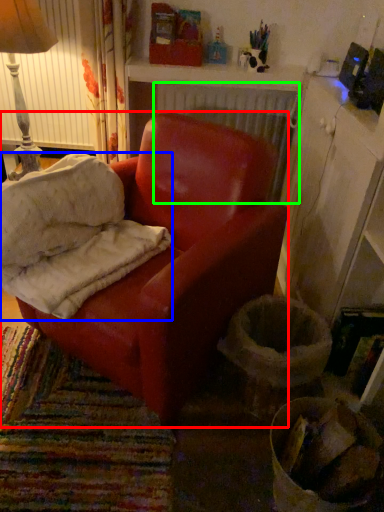
Question: Estimate the real-world distances between objects in this image. Which object is closer to chair (highlighted by a red box), material (highlighted by a blue box) or radiator (highlighted by a green box)?

Choices:
 (A) material
 (B) radiator

Answer: (A)